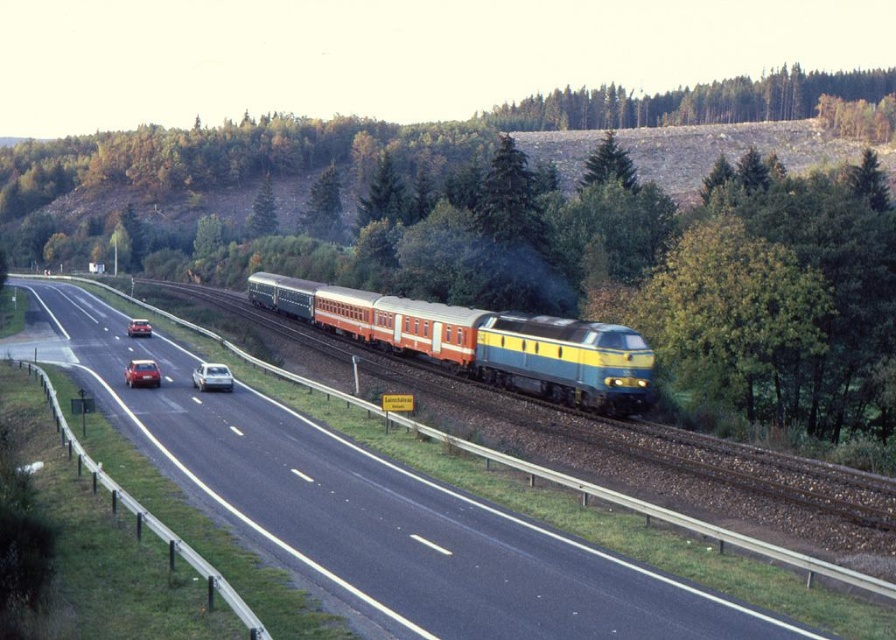
Question: Which of the following is the farthest from the observer?

Choices:
 (A) [x=714, y=621]
 (B) [x=149, y=324]

Answer: (B)

Question: Which point is farther to the camera?

Choices:
 (A) (407, 310)
 (B) (136, 326)
 (C) (222, 403)

Answer: (B)

Question: Can you confirm if black asphalt highway at center is positioned below silver metallic car at center?

Choices:
 (A) yes
 (B) no

Answer: (A)

Question: Does black asphalt highway at center appear on the right side of silver metallic car at center?

Choices:
 (A) yes
 (B) no

Answer: (A)

Question: Is orange/yellow painted coach at center positioned in front of silver metallic car at center?

Choices:
 (A) no
 (B) yes

Answer: (B)

Question: Which object appears closest to the camera in this image?

Choices:
 (A) silver metallic car at center
 (B) matte red car at left
 (C) black asphalt highway at center
 (D) shiny red sedan at left

Answer: (C)